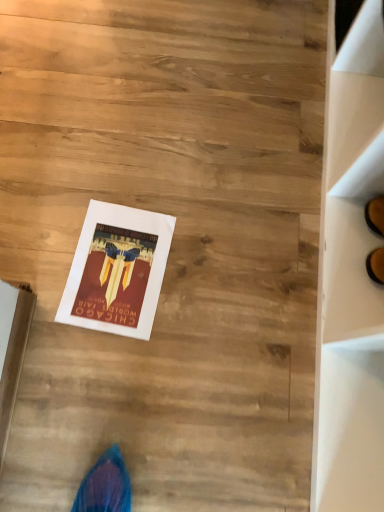
Question: In terms of width, does white cardboard box at lower left look wider or thinner when compared to matte paper poster at center?

Choices:
 (A) thin
 (B) wide

Answer: (A)

Question: Does point [x=1, y=347] appear closer or farther from the camera than point [x=155, y=215]?

Choices:
 (A) farther
 (B) closer

Answer: (B)

Question: From a real-world perspective, relative to matte paper poster at center, is white cardboard box at lower left vertically above or below?

Choices:
 (A) below
 (B) above

Answer: (B)

Question: Is matte paper poster at center wider or thinner than white cardboard box at lower left?

Choices:
 (A) wide
 (B) thin

Answer: (A)

Question: From the image's perspective, is matte paper poster at center above or below white cardboard box at lower left?

Choices:
 (A) below
 (B) above

Answer: (B)

Question: From a real-world perspective, relative to white cardboard box at lower left, is matte paper poster at center vertically above or below?

Choices:
 (A) above
 (B) below

Answer: (B)

Question: Considering their positions, is matte paper poster at center located in front of or behind white cardboard box at lower left?

Choices:
 (A) behind
 (B) front

Answer: (A)